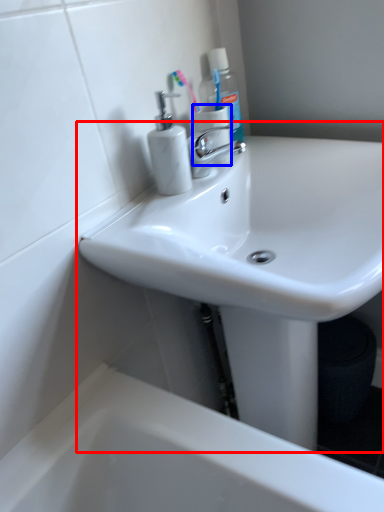
Question: Which point is further to the camera, sink (highlighted by a red box) or toilet paper (highlighted by a blue box)?

Choices:
 (A) sink
 (B) toilet paper

Answer: (B)